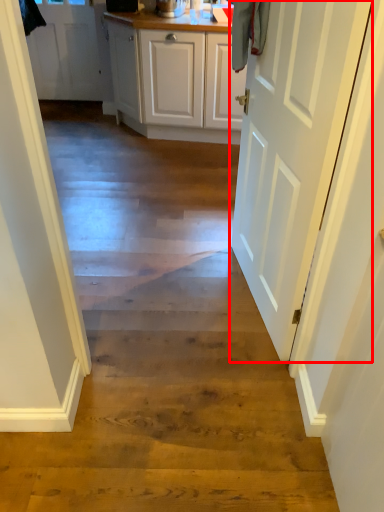
Question: Considering the relative positions of door (annotated by the red box) and door in the image provided, where is door (annotated by the red box) located with respect to the staircase?

Choices:
 (A) right
 (B) left

Answer: (A)